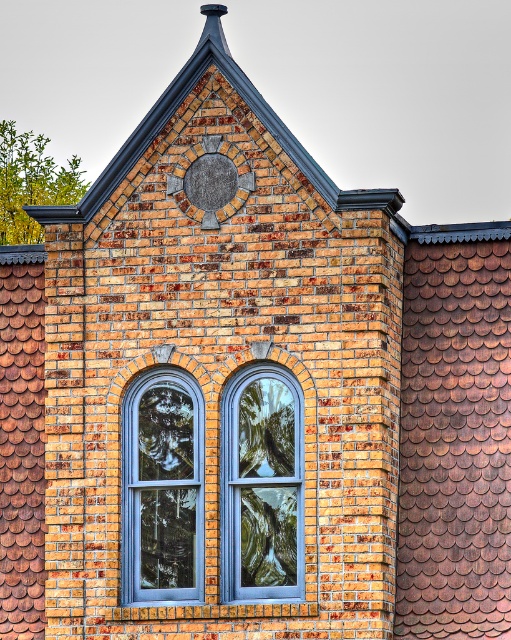
Is brown shingles at upper center taller than blue glass window at center?

Indeed, brown shingles at upper center has a greater height compared to blue glass window at center.

This screenshot has width=511, height=640. I want to click on brown shingles at upper center, so click(292, 84).

This screenshot has height=640, width=511. Find the location of `brown shingles at upper center`. brown shingles at upper center is located at coordinates (292, 84).

Who is higher up, blue glass window at center or matte gray clock at center?

Positioned higher is matte gray clock at center.

Who is lower down, blue glass window at center or matte gray clock at center?

blue glass window at center is below.

What do you see at coordinates (162, 486) in the screenshot?
I see `blue glass window at center` at bounding box center [162, 486].

Locate an element on the screen. blue glass window at center is located at coordinates (162, 486).

Is point (295, 401) more distant than point (226, 209)?

That is False.

Does matte glass window at center appear over matte gray clock at center?

Actually, matte glass window at center is below matte gray clock at center.

Which is in front, point (258, 465) or point (227, 202)?

Point (258, 465)

The image size is (511, 640). In order to click on matte glass window at center in this screenshot , I will do tap(262, 484).